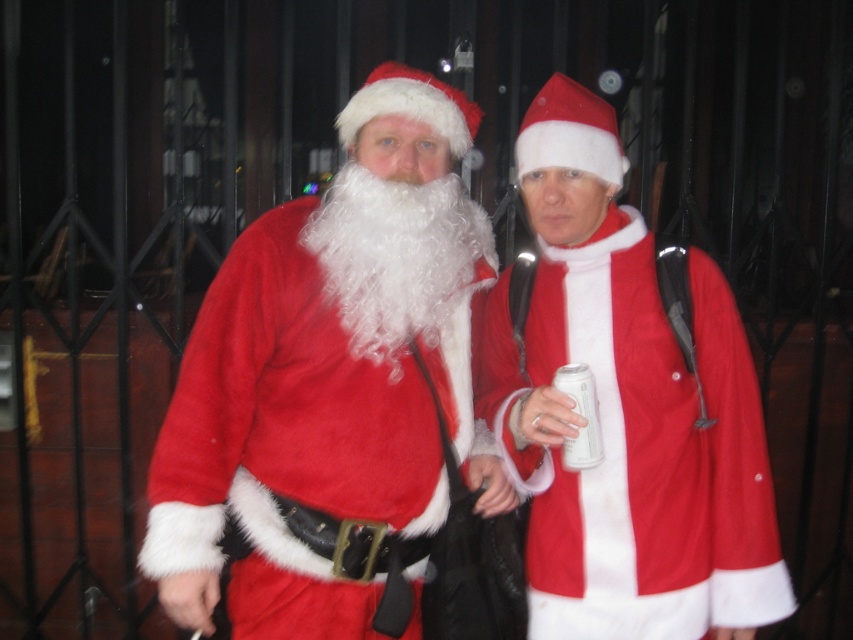
Is point (682, 364) closer to viewer compared to point (392, 333)?

That is False.

At what (x,y) coordinates should I click in order to perform the action: click on fuzzy red coat at center. Please return your answer as a coordinate pair (x, y). The height and width of the screenshot is (640, 853). Looking at the image, I should click on (625, 410).

Is white curly fur beard at center further to camera compared to white matte can at center?

Yes, white curly fur beard at center is behind white matte can at center.

Is white curly fur beard at center shorter than white matte can at center?

No.

In the scene shown: Measure the distance between point (450, 300) and camera.

They are 6.76 feet apart.

Where is `white curly fur beard at center`? white curly fur beard at center is located at coordinates tap(397, 257).

Between point (231, 404) and point (396, 355), which one is positioned in front?

Point (231, 404) is in front.

Does fuzzy red santa at center come behind white curly fur beard at center?

No, fuzzy red santa at center is in front of white curly fur beard at center.

Does point (279, 468) come farther from viewer compared to point (393, 349)?

No.

This screenshot has width=853, height=640. What are the coordinates of `fuzzy red santa at center` in the screenshot? It's located at (334, 388).